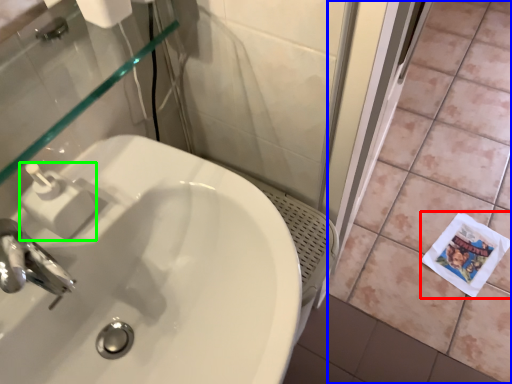
Question: Which is farther away from paper (highlighted by a red box)? ceramic tile (highlighted by a blue box) or soap dispenser (highlighted by a green box)?

Choices:
 (A) ceramic tile
 (B) soap dispenser

Answer: (B)